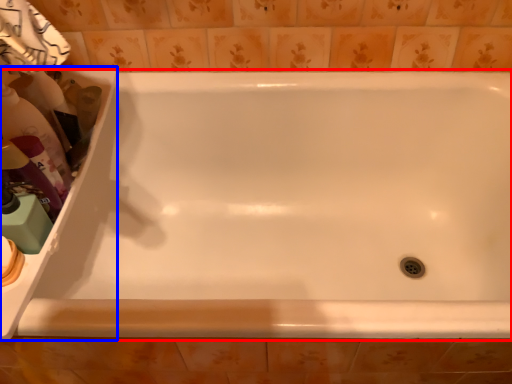
Question: Which object is further to the camera taking this photo, bathtub (highlighted by a red box) or sink (highlighted by a blue box)?

Choices:
 (A) bathtub
 (B) sink

Answer: (B)